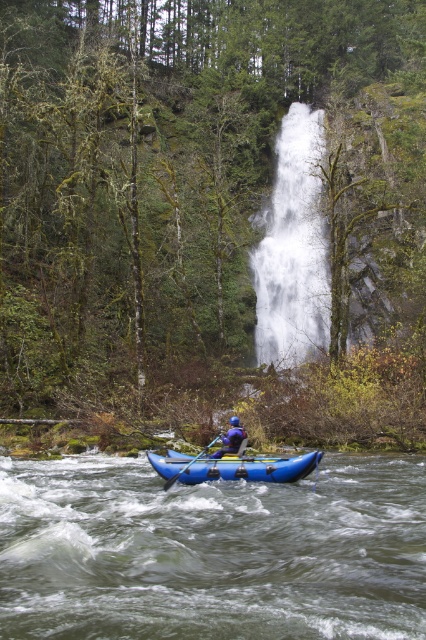
Question: Is blue rubber raft at center to the right of blue rubber paddle at center from the viewer's perspective?

Choices:
 (A) no
 (B) yes

Answer: (B)

Question: Which point is closer to the camera?

Choices:
 (A) (227, 451)
 (B) (195, 554)
 (C) (175, 476)

Answer: (B)

Question: Is blue rubber raft at lower center above blue rubber paddle at center?

Choices:
 (A) yes
 (B) no

Answer: (A)

Question: Which of the following is the closest to the observer?

Choices:
 (A) blue rubber paddle at center
 (B) white frothy water at center
 (C) blue rubber raft at center

Answer: (C)

Question: Which point is closer to the camera taking this photo?

Choices:
 (A) (186, 464)
 (B) (206, 448)
 (C) (236, 435)
 (D) (307, 566)

Answer: (D)

Question: Is blue rubber raft at lower center bigger than blue rubber raft at center?

Choices:
 (A) no
 (B) yes

Answer: (B)